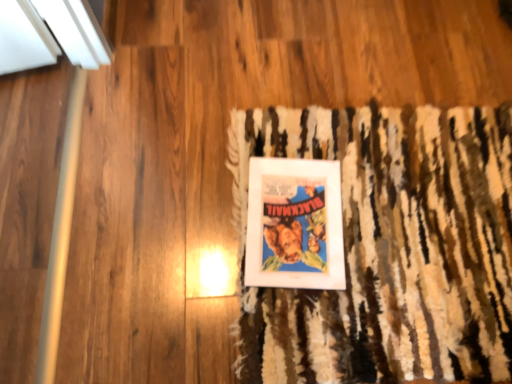
Find the location of a particular element. vacant space underneath textured brown doormat at center (from a real-world perspective) is located at coordinates [374, 223].